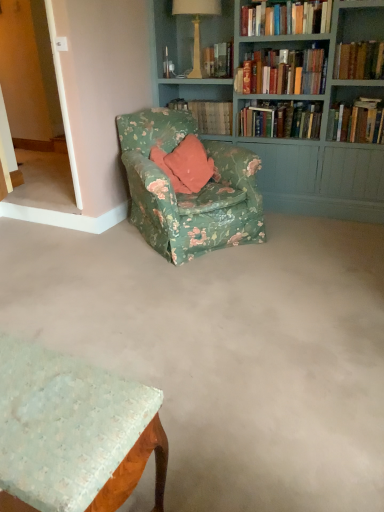
What are the coordinates of `empty space that is ontop of floral fabric table at lower left` in the screenshot? It's located at (44, 397).